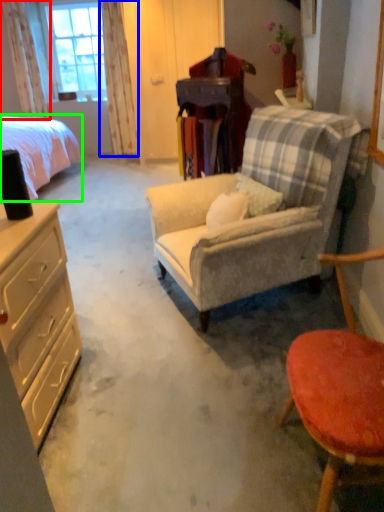
Question: Which is nearer to the curtain (highlighted by a red box)? curtain (highlighted by a blue box) or bed (highlighted by a green box).

Choices:
 (A) curtain
 (B) bed

Answer: (A)